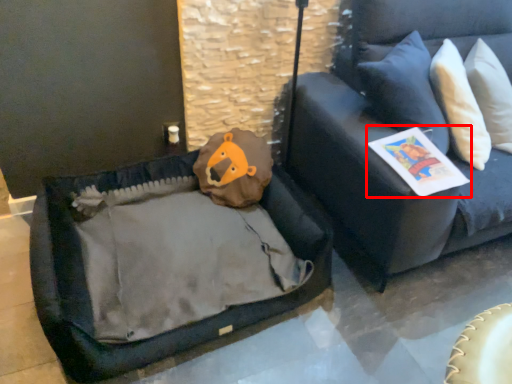
Question: Observing the image, what is the correct spatial positioning of magazine (annotated by the red box) in reference to studio couch?

Choices:
 (A) left
 (B) right

Answer: (A)